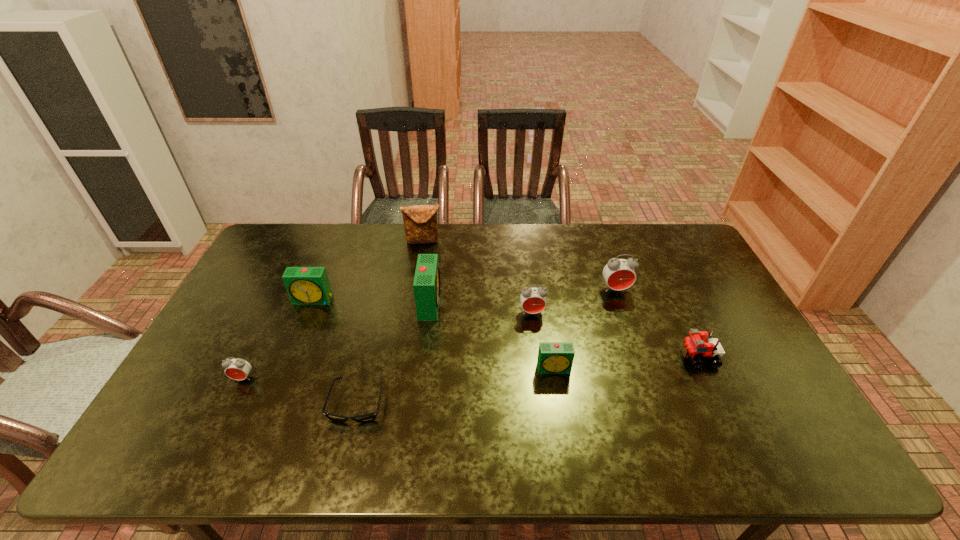
Find the location of a particular element. blank space located on the front-facing side of the second smallest green alarm clock is located at coordinates (280, 381).

Locate an element on the screen. This screenshot has height=540, width=960. free space located 0.050m on the front-facing side of the Lego is located at coordinates (662, 357).

At what (x,y) coordinates should I click in order to perform the action: click on vacant space situated on the front-facing side of the Lego. Please return your answer as a coordinate pair (x, y). Looking at the image, I should click on (572, 357).

You are a GUI agent. You are given a task and a screenshot of the screen. Output one action in this format:
    pyautogui.click(x=<x>, y=<y>)
    Task: Click on the free spot located 0.260m on the front-facing side of the Lego
    The width and height of the screenshot is (960, 540).
    Given the screenshot: What is the action you would take?
    pyautogui.click(x=587, y=357)

You are a GUI agent. You are given a task and a screenshot of the screen. Output one action in this format:
    pyautogui.click(x=<x>, y=<y>)
    Task: Click on the vacant space situated on the face of the smallest red alarm clock
    This screenshot has width=960, height=540.
    Given the screenshot: What is the action you would take?
    pyautogui.click(x=215, y=436)

You are a GUI agent. You are given a task and a screenshot of the screen. Output one action in this format:
    pyautogui.click(x=<x>, y=<y>)
    Task: Click on the free space located 0.080m on the front-facing side of the smallest green alarm clock
    This screenshot has height=540, width=960.
    Given the screenshot: What is the action you would take?
    point(560,401)

This screenshot has height=540, width=960. Find the location of `object that is at the far edge`. object that is at the far edge is located at coordinates (420, 222).

Locate an element on the screen. The height and width of the screenshot is (540, 960). object located at the left edge is located at coordinates (238, 369).

At what (x,y) coordinates should I click in order to perform the action: click on object that is at the right edge. Please return your answer as a coordinate pair (x, y). Image resolution: width=960 pixels, height=540 pixels. Looking at the image, I should click on (693, 347).

Image resolution: width=960 pixels, height=540 pixels. In the image, there is a desktop. Find the location of `vacant space at the far edge`. vacant space at the far edge is located at coordinates (542, 259).